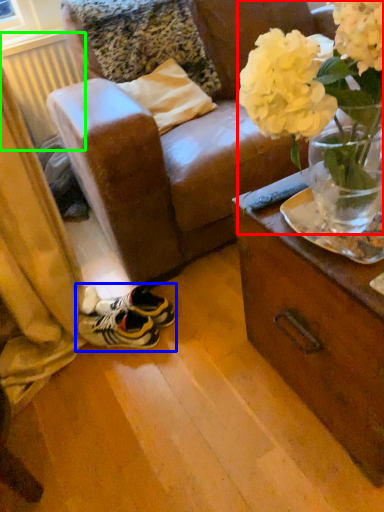
Question: Which object is the closest to the floral arrangement (highlighted by a red box)? Choose among these: footwear (highlighted by a blue box) or radiator (highlighted by a green box).

Choices:
 (A) footwear
 (B) radiator

Answer: (A)